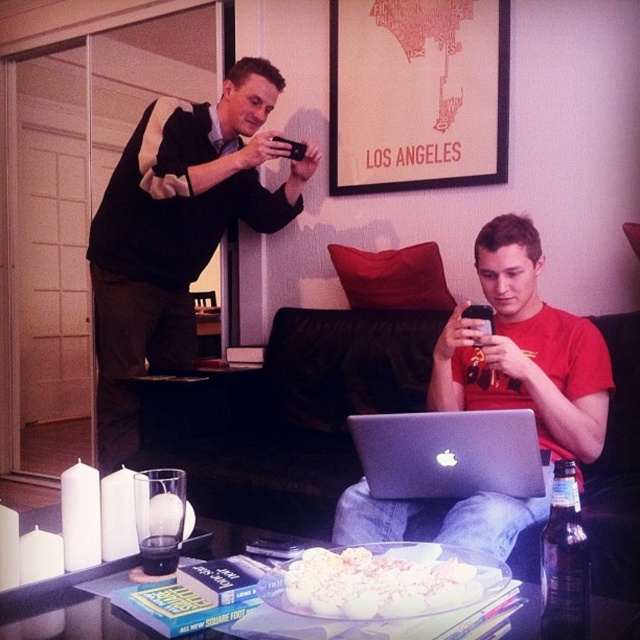
Question: Which is nearer to the clear glass at center?

Choices:
 (A) black matte phone at upper left
 (B) dark brown glass bottle at lower right

Answer: (B)

Question: Which point is farther to the camera?

Choices:
 (A) clear glass at center
 (B) matte red shirt at center

Answer: (B)

Question: Is black leather couch at center above dark brown glass bottle at lower right?

Choices:
 (A) no
 (B) yes

Answer: (A)

Question: Does matte red shirt at center come behind silver metallic laptop at center?

Choices:
 (A) no
 (B) yes

Answer: (A)

Question: Can you confirm if silver metallic laptop at center is smaller than dark brown glass bottle at lower right?

Choices:
 (A) yes
 (B) no

Answer: (B)

Question: Which point is closer to the camera?

Choices:
 (A) matte red shirt at center
 (B) dark brown glass bottle at lower right
 (C) clear glass at center
 (D) silver metallic laptop at center

Answer: (B)